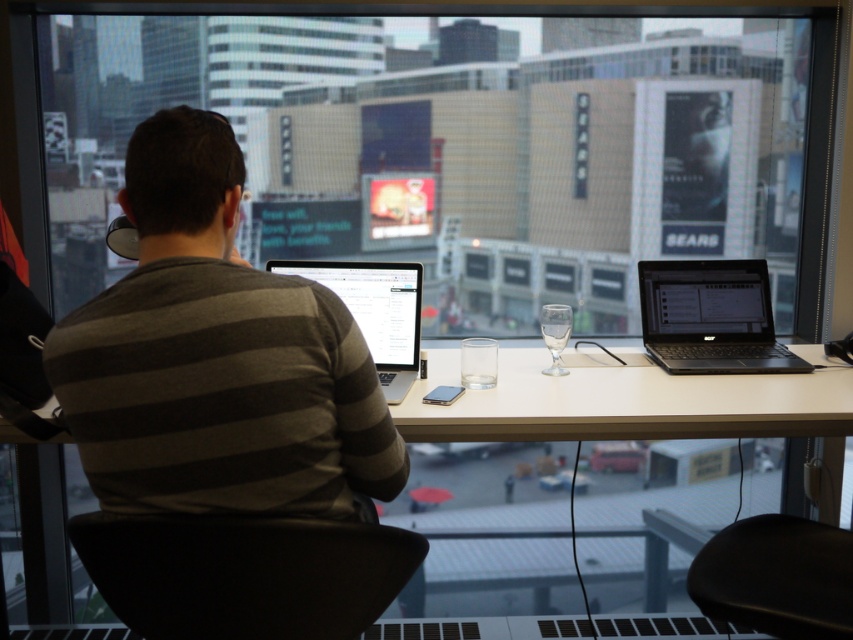
Question: Does black leather chair at lower center lie in front of clear glass wine glass at center?

Choices:
 (A) no
 (B) yes

Answer: (B)

Question: Which object appears closest to the camera in this image?

Choices:
 (A) black leather chair at lower center
 (B) black matte laptop at right

Answer: (A)

Question: Is black leather chair at lower center above black leather chair at lower right?

Choices:
 (A) yes
 (B) no

Answer: (A)

Question: Among these points, which one is nearest to the camera?

Choices:
 (A) (756, 282)
 (B) (381, 380)

Answer: (B)

Question: Does silver metallic laptop at center lie behind clear glass wine glass at center?

Choices:
 (A) no
 (B) yes

Answer: (A)

Question: Which point is farther to the camera?

Choices:
 (A) (316, 627)
 (B) (689, 278)
 (C) (770, 620)

Answer: (B)